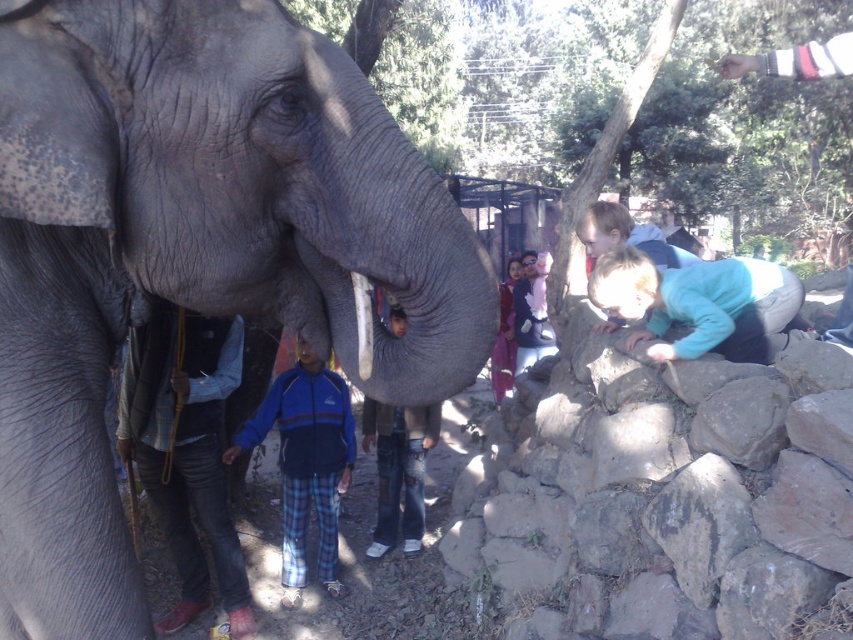
Question: Is gray matte elephant at left positioned behind denim pants at left?

Choices:
 (A) no
 (B) yes

Answer: (A)

Question: Which point is farther from the camera taking this photo?

Choices:
 (A) (680, 284)
 (B) (376, 540)
 (C) (189, 67)

Answer: (B)

Question: Considering the relative positions of light blue fleece at lower right and blue fleece jacket at lower left in the image provided, where is light blue fleece at lower right located with respect to blue fleece jacket at lower left?

Choices:
 (A) right
 (B) left

Answer: (A)

Question: Is light blue fleece at lower right positioned at the back of blue fleece jacket at lower left?

Choices:
 (A) yes
 (B) no

Answer: (B)

Question: Among these points, which one is nearest to the camera?

Choices:
 (A) (256, 408)
 (B) (177, 328)
 (C) (340, 316)
 (D) (712, 310)

Answer: (C)

Question: Which point appears closest to the camera in this image?

Choices:
 (A) pos(183,432)
 (B) pos(694,282)
 (C) pos(296,29)
 (D) pos(387,529)

Answer: (C)